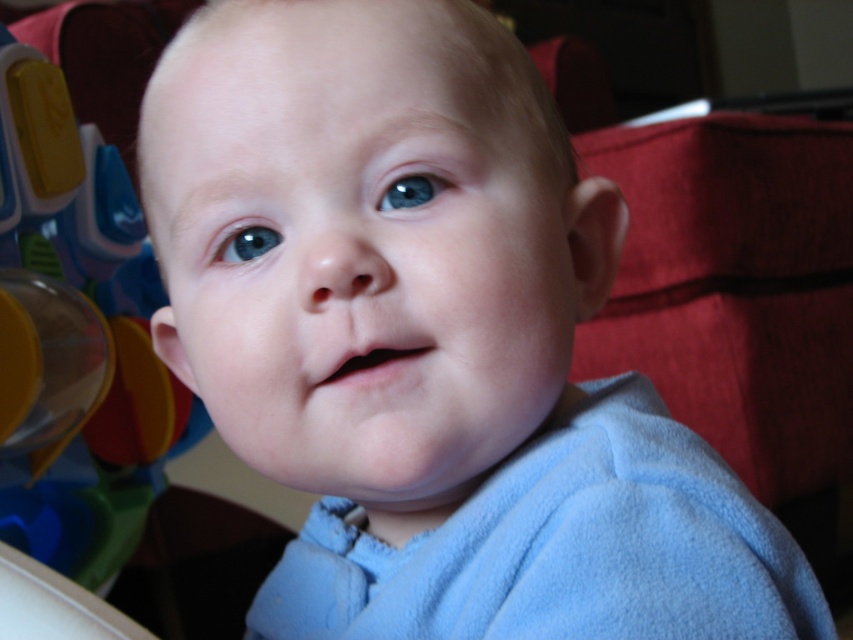
Question: Based on their relative distances, which object is farther from the blue glossy eye at center?

Choices:
 (A) blue smooth eye at upper center
 (B) transparent plastic toy at left

Answer: (B)

Question: Is transparent plastic toy at left positioned at the back of blue glossy eye at center?

Choices:
 (A) no
 (B) yes

Answer: (B)

Question: Which of the following is the closest to the observer?

Choices:
 (A) blue glossy eye at center
 (B) blue smooth eye at upper center
 (C) transparent plastic toy at left

Answer: (B)

Question: Which object appears farthest from the camera in this image?

Choices:
 (A) blue glossy eye at center
 (B) blue smooth eye at upper center

Answer: (A)

Question: Can you confirm if transparent plastic toy at left is thinner than blue smooth eye at upper center?

Choices:
 (A) no
 (B) yes

Answer: (A)

Question: Is the position of transparent plastic toy at left less distant than that of blue glossy eye at center?

Choices:
 (A) yes
 (B) no

Answer: (B)